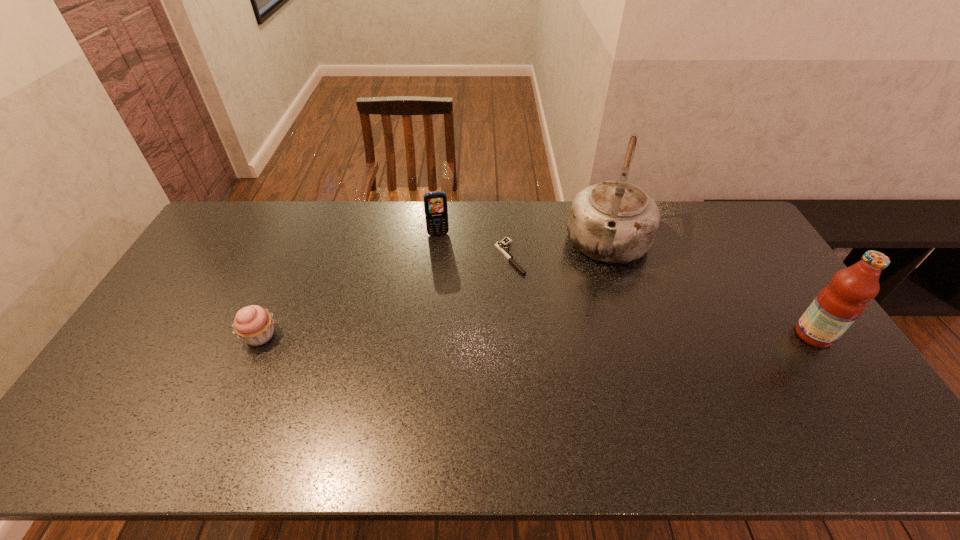
The height and width of the screenshot is (540, 960). I want to click on cupcake, so click(253, 324).

Where is `the fourth tallest object`? The image size is (960, 540). the fourth tallest object is located at coordinates (253, 324).

At what (x,y) coordinates should I click in order to perform the action: click on fruit juice. Please return your answer as a coordinate pair (x, y). The height and width of the screenshot is (540, 960). Looking at the image, I should click on (839, 304).

Identify the location of the rightmost object. (839, 304).

At what (x,y) coordinates should I click in order to perform the action: click on kettle. Please return your answer as a coordinate pair (x, y). Image resolution: width=960 pixels, height=540 pixels. Looking at the image, I should click on (614, 221).

At what (x,y) coordinates should I click in order to perform the action: click on the second object from right to left. Please return your answer as a coordinate pair (x, y). The width and height of the screenshot is (960, 540). Looking at the image, I should click on (614, 221).

Find the location of `the third object from left to right`. the third object from left to right is located at coordinates (501, 246).

At what (x,y) coordinates should I click in order to perform the action: click on pistol. Please return your answer as a coordinate pair (x, y). This screenshot has width=960, height=540. Looking at the image, I should click on (501, 246).

Locate an element on the screen. The width and height of the screenshot is (960, 540). the second object from left to right is located at coordinates (435, 203).

Where is `cellular telephone`? This screenshot has width=960, height=540. cellular telephone is located at coordinates (435, 203).